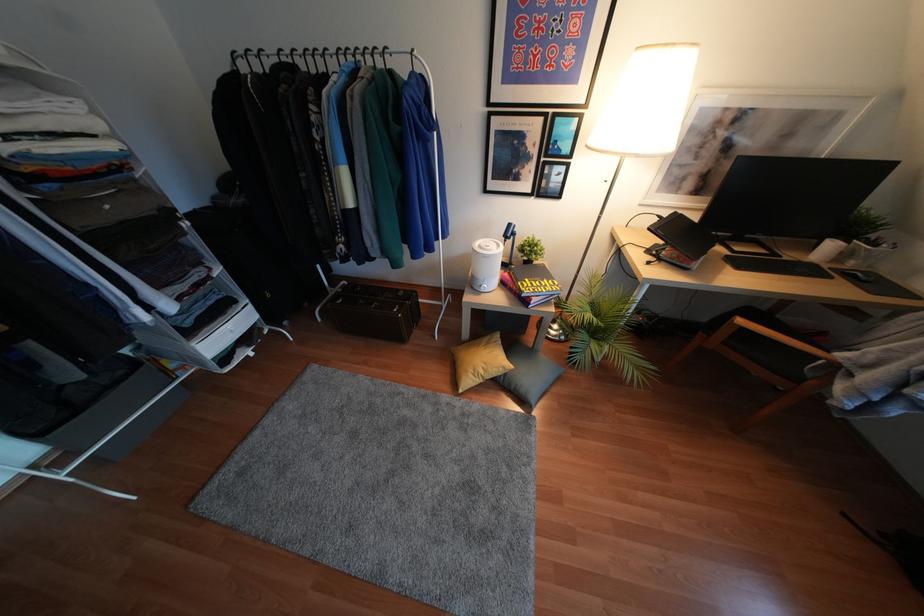
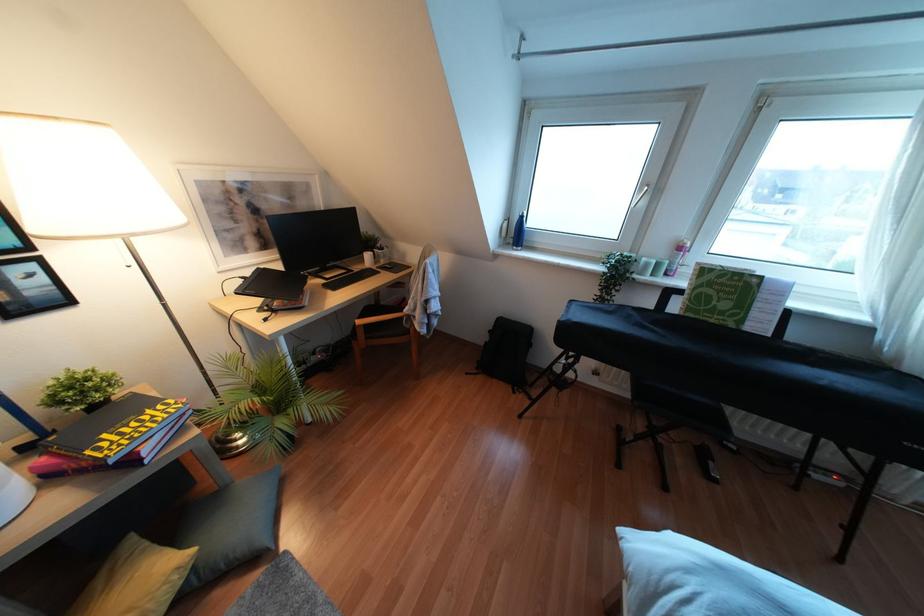
Question: The images are taken continuously from a first-person perspective. In which direction is your viewpoint rotating?

Choices:
 (A) Left
 (B) Right
 (C) Up
 (D) Down

Answer: (B)